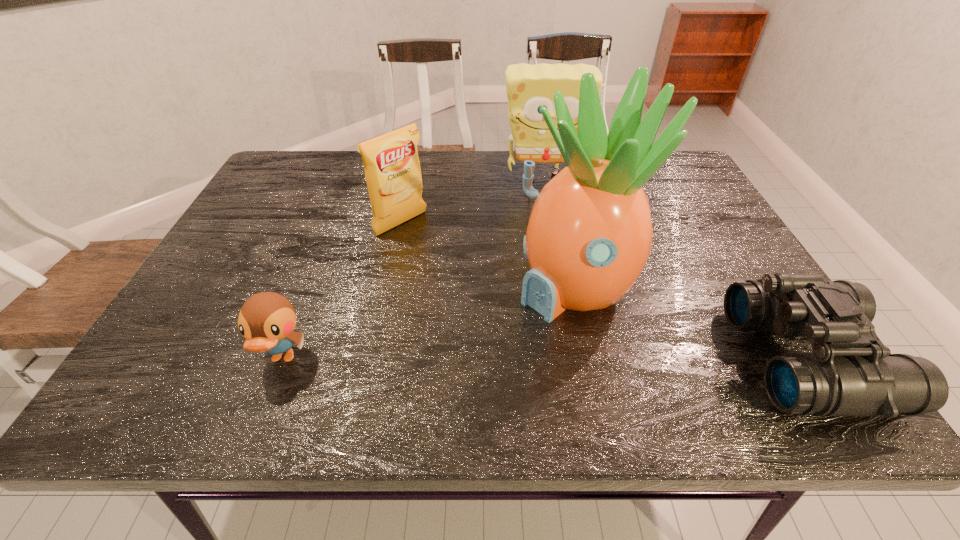
At what (x,y) coordinates should I click in order to perform the action: click on duck. Please return your answer as a coordinate pair (x, y). Looking at the image, I should click on (266, 320).

The image size is (960, 540). Find the location of `the rightmost object`. the rightmost object is located at coordinates 850,373.

At what (x,y) coordinates should I click in order to perform the action: click on crisp (potato chip). Please return your answer as a coordinate pair (x, y). Looking at the image, I should click on (392, 169).

Where is `the third tallest object`? The image size is (960, 540). the third tallest object is located at coordinates (392, 169).

I want to click on pineapple, so click(x=589, y=236).

At what (x,y) coordinates should I click in order to perform the action: click on the farthest object. Please return your answer as a coordinate pair (x, y). Looking at the image, I should click on (528, 87).

Locate an element on the screen. This screenshot has width=960, height=540. sponge is located at coordinates (528, 87).

Locate an element on the screen. The height and width of the screenshot is (540, 960). blank space located through the lenses of the binoculars is located at coordinates tap(559, 359).

Where is `vacant area located 0.360m through the lenses of the binoculars`? Image resolution: width=960 pixels, height=540 pixels. vacant area located 0.360m through the lenses of the binoculars is located at coordinates [559, 359].

Locate an element on the screen. free space located through the lenses of the binoculars is located at coordinates (632, 359).